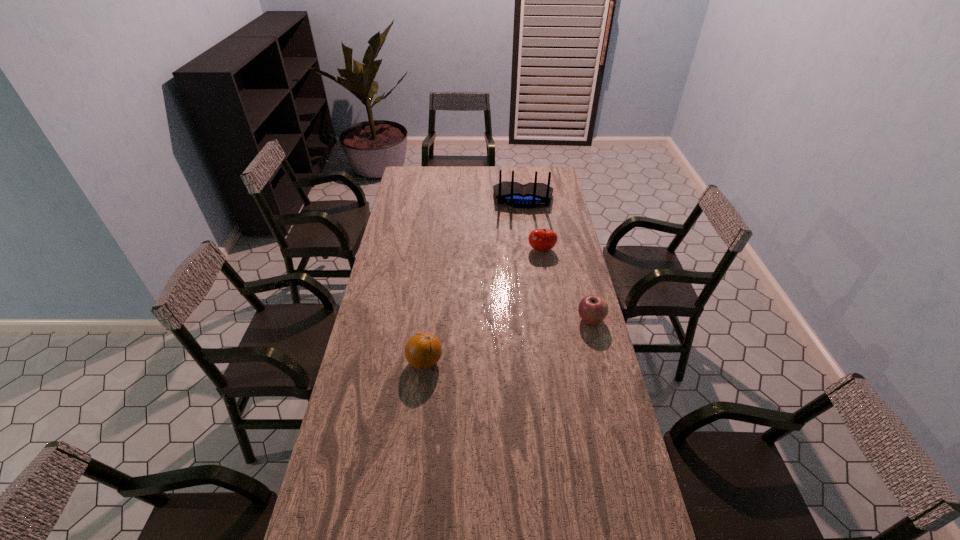
The height and width of the screenshot is (540, 960). What are the coordinates of `vacant space on the desktop that is between the leftmost object and the right apple and is positioned on the back of the router` in the screenshot? It's located at (521, 338).

This screenshot has height=540, width=960. What are the coordinates of `vacant spot on the desktop that is between the orange and the nearer apple and is positioned on the stem of the third nearest object` in the screenshot? It's located at (526, 336).